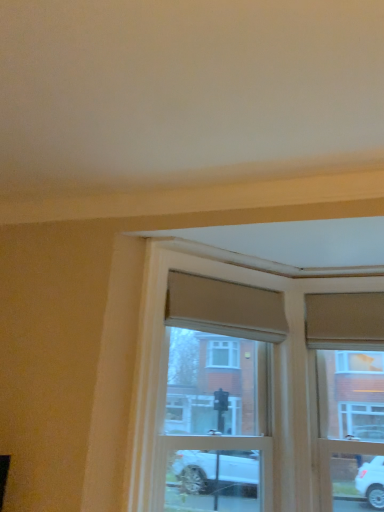
Question: From their relative heights in the image, would you say wooden window frame at center is taller or shorter than wooden window frame at upper right?

Choices:
 (A) short
 (B) tall

Answer: (B)

Question: Looking at their shapes, would you say wooden window frame at center is wider or thinner than wooden window frame at upper right?

Choices:
 (A) thin
 (B) wide

Answer: (B)

Question: Is wooden window frame at center to the left or to the right of wooden window frame at upper right in the image?

Choices:
 (A) left
 (B) right

Answer: (A)

Question: In terms of size, does wooden window frame at upper right appear bigger or smaller than wooden window frame at center?

Choices:
 (A) big
 (B) small

Answer: (B)

Question: In terms of height, does wooden window frame at upper right look taller or shorter compared to wooden window frame at center?

Choices:
 (A) short
 (B) tall

Answer: (A)

Question: In the image, is wooden window frame at upper right on the left side or the right side of wooden window frame at center?

Choices:
 (A) left
 (B) right

Answer: (B)

Question: Is wooden window frame at upper right in front of or behind wooden window frame at center in the image?

Choices:
 (A) behind
 (B) front

Answer: (A)